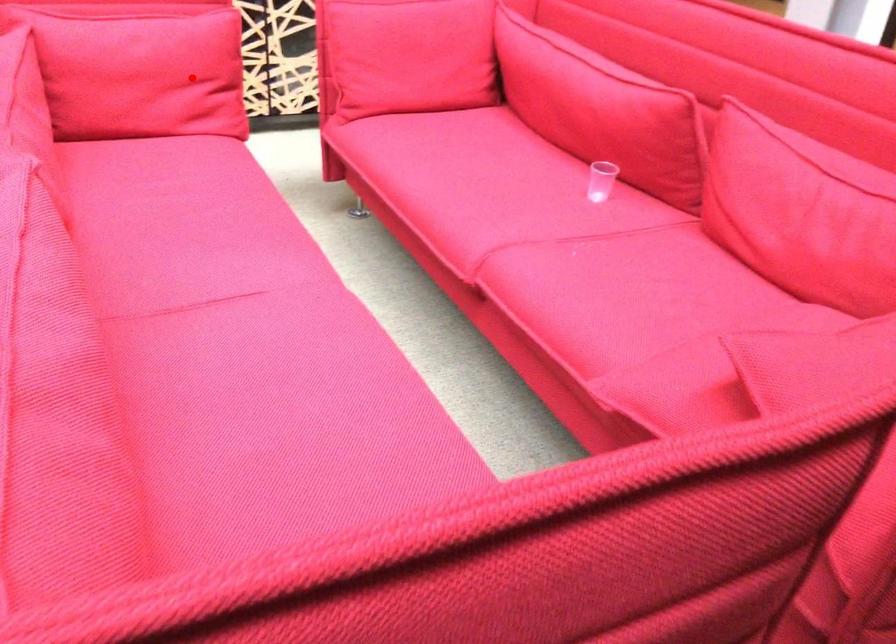
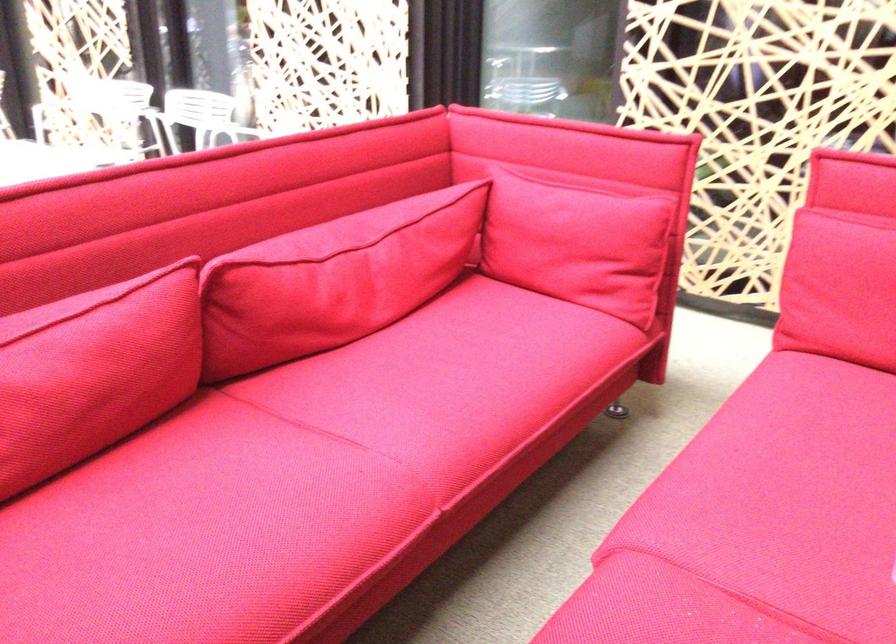
Question: I am providing you with two images of the same scene from different viewpoints. A red point is marked on the first image. Can you still see the location of the red point in image 2?

Choices:
 (A) Yes
 (B) No

Answer: (A)